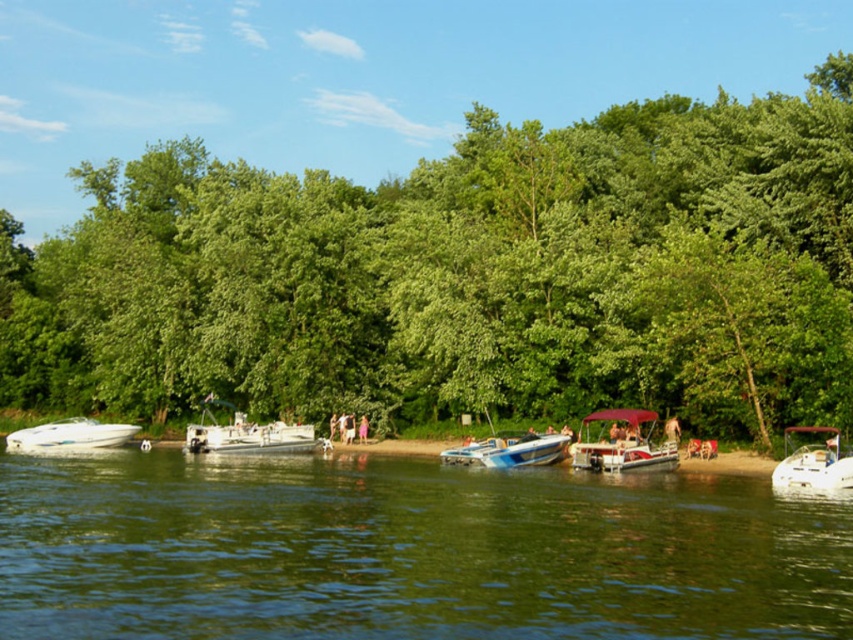
Question: Can you confirm if white plastic boat at center is wider than white glossy boat at lower left?

Choices:
 (A) yes
 (B) no

Answer: (B)

Question: Which point is farther to the camera?

Choices:
 (A) red fabric pontoon boat at center
 (B) green leafy trees at center
 (C) green glossy water at center

Answer: (A)

Question: Is green leafy trees at center below white glossy boat at lower right?

Choices:
 (A) yes
 (B) no

Answer: (B)

Question: Which object appears farthest from the camera in this image?

Choices:
 (A) white glossy boat at lower right
 (B) green glossy water at center

Answer: (A)

Question: Which point is farther to the camera?

Choices:
 (A) red fabric pontoon boat at center
 (B) blue plastic boat at center
 (C) white glossy boat at lower left

Answer: (C)

Question: Does green glossy water at center have a lesser width compared to blue plastic boat at center?

Choices:
 (A) yes
 (B) no

Answer: (B)